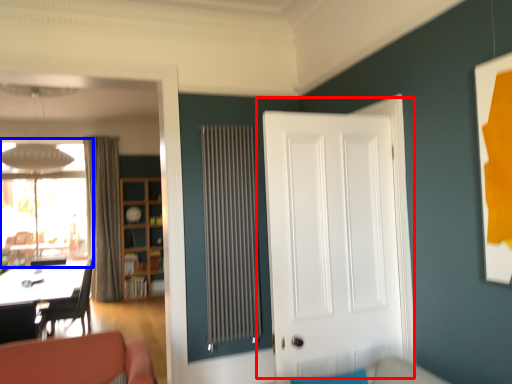
Question: Which object appears farthest to the camera in this image, door (highlighted by a red box) or window (highlighted by a blue box)?

Choices:
 (A) door
 (B) window

Answer: (B)